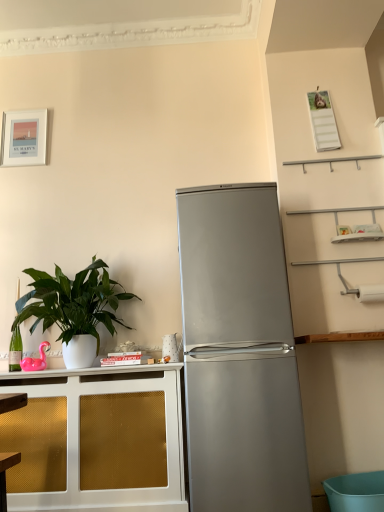
Question: Can you confirm if silver metallic refrigerator at center is shorter than satin silver refrigerator at center?

Choices:
 (A) no
 (B) yes

Answer: (B)

Question: Is silver metallic refrigerator at center positioned beyond the bounds of satin silver refrigerator at center?

Choices:
 (A) yes
 (B) no

Answer: (A)

Question: Does silver metallic refrigerator at center contain satin silver refrigerator at center?

Choices:
 (A) yes
 (B) no

Answer: (B)

Question: Is silver metallic refrigerator at center smaller than satin silver refrigerator at center?

Choices:
 (A) yes
 (B) no

Answer: (A)

Question: Can you confirm if silver metallic refrigerator at center is positioned to the right of satin silver refrigerator at center?

Choices:
 (A) yes
 (B) no

Answer: (B)

Question: From the image's perspective, is silver metallic refrigerator at center above satin silver refrigerator at center?

Choices:
 (A) no
 (B) yes

Answer: (A)

Question: Is gold mesh cabinet at left positioned behind matte white picture frame at upper left?

Choices:
 (A) no
 (B) yes

Answer: (A)

Question: From a real-world perspective, does gold mesh cabinet at left stand above matte white picture frame at upper left?

Choices:
 (A) no
 (B) yes

Answer: (A)

Question: From a real-world perspective, is gold mesh cabinet at left below matte white picture frame at upper left?

Choices:
 (A) no
 (B) yes

Answer: (B)

Question: Considering the relative sizes of gold mesh cabinet at left and matte white picture frame at upper left in the image provided, is gold mesh cabinet at left smaller than matte white picture frame at upper left?

Choices:
 (A) no
 (B) yes

Answer: (A)

Question: Can you confirm if gold mesh cabinet at left is shorter than matte white picture frame at upper left?

Choices:
 (A) no
 (B) yes

Answer: (A)

Question: Is gold mesh cabinet at left not near matte white picture frame at upper left?

Choices:
 (A) yes
 (B) no

Answer: (A)

Question: Is green glossy plant at left in front of satin silver refrigerator at center?

Choices:
 (A) yes
 (B) no

Answer: (B)